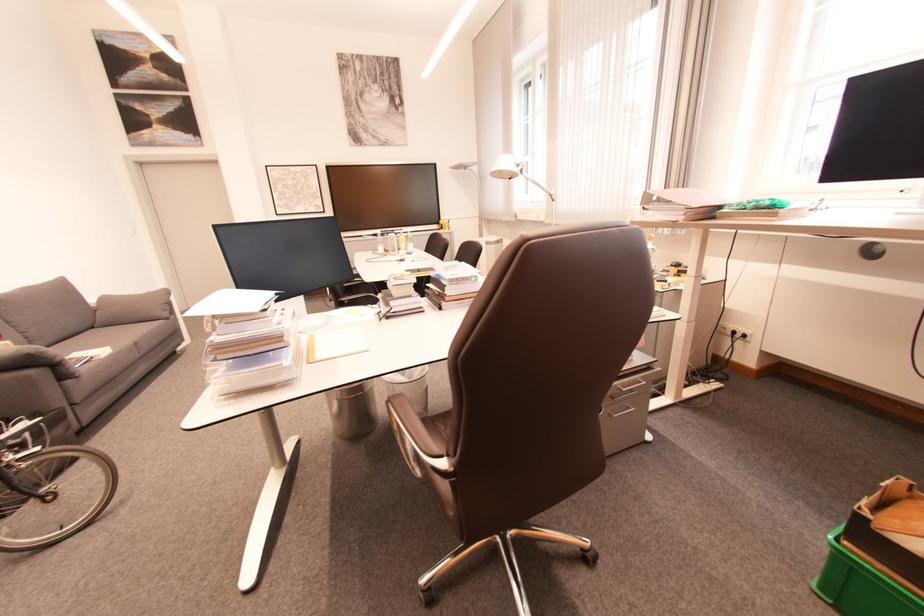
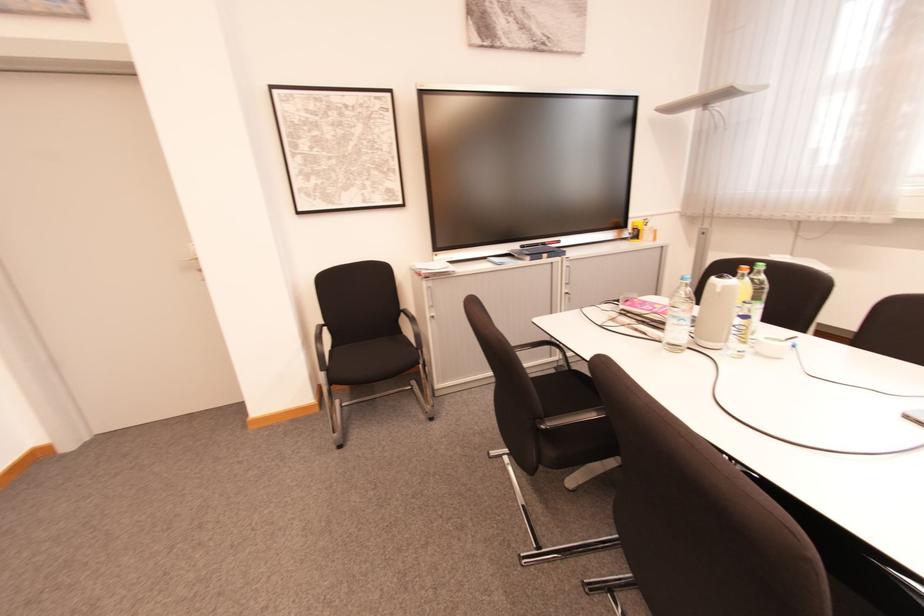
What movement of the cameraman would produce the second image?

The cameraman walked toward left, forward.